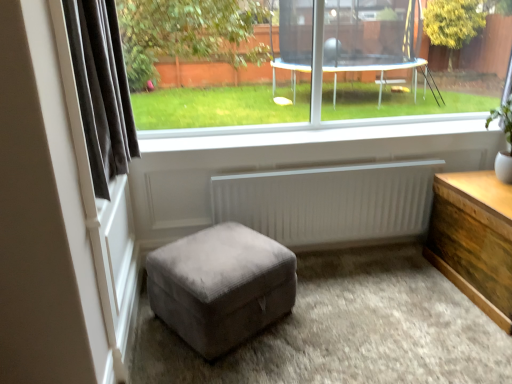
Describe the element at coordinates (221, 286) in the screenshot. I see `suede ottoman at center` at that location.

Describe the element at coordinates (330, 203) in the screenshot. The width and height of the screenshot is (512, 384). I see `white ribbed radiator at center` at that location.

Find the location of a particular element. wooden chest at right is located at coordinates (474, 239).

Locate an element on the screen. dark grey fabric curtain at left is located at coordinates point(101,89).

Can you confirm if transparent glass window at center is positioned to the left of wooden chest at right?

Indeed, transparent glass window at center is positioned on the left side of wooden chest at right.

How different are the orientations of transparent glass window at center and wooden chest at right in degrees?

90 degrees.

Is wooden chest at right inside transparent glass window at center?

That's incorrect, wooden chest at right is not inside transparent glass window at center.

Considering the sizes of transparent glass window at center and wooden chest at right in the image, is transparent glass window at center taller or shorter than wooden chest at right?

Considering their sizes, transparent glass window at center has more height than wooden chest at right.

Who is shorter, white ribbed radiator at center or transparent glass window at center?

With less height is white ribbed radiator at center.

Are white ribbed radiator at center and transparent glass window at center beside each other?

They are not placed beside each other.

From a real-world perspective, is white ribbed radiator at center physically above transparent glass window at center?

Actually, white ribbed radiator at center is physically below transparent glass window at center in the real world.

Based on their sizes in the image, would you say white smooth window sill at center is bigger or smaller than suede ottoman at center?

Clearly, white smooth window sill at center is smaller in size than suede ottoman at center.

How different are the orientations of white smooth window sill at center and suede ottoman at center in degrees?

33.8 degrees.

Is white smooth window sill at center turned away from suede ottoman at center?

white smooth window sill at center is not turned away from suede ottoman at center.

Is suede ottoman at center facing away from white smooth window sill at center?

No, suede ottoman at center is not facing the opposite direction of white smooth window sill at center.

Measure the distance between suede ottoman at center and white smooth window sill at center.

93.62 centimeters.

Choose the correct answer: Is suede ottoman at center inside white smooth window sill at center or outside it?

suede ottoman at center is not inside white smooth window sill at center, it's outside.

At what (x,y) coordinates should I click in order to perform the action: click on window sill above the suede ottoman at center (from the image's perspective). Please return your answer as a coordinate pair (x, y). Looking at the image, I should click on (309, 132).

Consider the image. Between suede ottoman at center and transparent glass window at center, which one has smaller width?

transparent glass window at center is thinner.

Is suede ottoman at center looking in the opposite direction of transparent glass window at center?

suede ottoman at center is not turned away from transparent glass window at center.

Is suede ottoman at center bigger or smaller than transparent glass window at center?

Considering their sizes, suede ottoman at center takes up less space than transparent glass window at center.

Is white ribbed radiator at center oriented away from dark grey fabric curtain at left?

No, white ribbed radiator at center's orientation is not away from dark grey fabric curtain at left.

In the scene shown: Can you confirm if white ribbed radiator at center is shorter than dark grey fabric curtain at left?

Indeed, white ribbed radiator at center has a lesser height compared to dark grey fabric curtain at left.

The width and height of the screenshot is (512, 384). In order to click on curtain on the left of white ribbed radiator at center in this screenshot , I will do `click(101, 89)`.

Which is in front, white ribbed radiator at center or dark grey fabric curtain at left?

dark grey fabric curtain at left is more forward.

Does transparent glass window at center contain white ribbed radiator at center?

That's incorrect, white ribbed radiator at center is not inside transparent glass window at center.

From the image's perspective, is transparent glass window at center located above or below white ribbed radiator at center?

Based on their image positions, transparent glass window at center is located above white ribbed radiator at center.

Which is more to the right, transparent glass window at center or white ribbed radiator at center?

white ribbed radiator at center is more to the right.

Which of these two, transparent glass window at center or white ribbed radiator at center, stands shorter?

With less height is white ribbed radiator at center.

Find the location of a particular element. window on the left of wooden chest at right is located at coordinates (404, 63).

You are a GUI agent. You are given a task and a screenshot of the screen. Output one action in this format:
    pyautogui.click(x=<x>, y=<y>)
    Task: Click on the radiator located behind the transparent glass window at center
    
    Given the screenshot: What is the action you would take?
    pyautogui.click(x=330, y=203)

Considering their positions, is wooden chest at right positioned closer to dark grey fabric curtain at left than white ribbed radiator at center?

white ribbed radiator at center is positioned closer to the anchor dark grey fabric curtain at left.

From the image, which object appears to be farther from white ribbed radiator at center, suede ottoman at center or dark grey fabric curtain at left?

dark grey fabric curtain at left lies further to white ribbed radiator at center than the other object.

When comparing their distances from white ribbed radiator at center, does suede ottoman at center or white smooth window sill at center seem further?

suede ottoman at center lies further to white ribbed radiator at center than the other object.

Based on their spatial positions, is white smooth window sill at center or suede ottoman at center closer to transparent glass window at center?

white smooth window sill at center lies closer to transparent glass window at center than the other object.

When comparing their distances from white ribbed radiator at center, does wooden chest at right or transparent glass window at center seem further?

transparent glass window at center.

Based on their spatial positions, is suede ottoman at center or transparent glass window at center closer to white ribbed radiator at center?

suede ottoman at center is closer to white ribbed radiator at center.

Which object lies further to the anchor point dark grey fabric curtain at left, white ribbed radiator at center or suede ottoman at center?

Among the two, white ribbed radiator at center is located further to dark grey fabric curtain at left.

From the image, which object appears to be farther from suede ottoman at center, wooden chest at right or white ribbed radiator at center?

wooden chest at right is positioned further to the anchor suede ottoman at center.

Image resolution: width=512 pixels, height=384 pixels. I want to click on curtain between transparent glass window at center and suede ottoman at center vertically, so click(101, 89).

The image size is (512, 384). Find the location of `radiator that lies between white smooth window sill at center and suede ottoman at center from top to bottom`. radiator that lies between white smooth window sill at center and suede ottoman at center from top to bottom is located at coordinates (330, 203).

Locate an element on the screen. The image size is (512, 384). window sill situated between suede ottoman at center and wooden chest at right from left to right is located at coordinates (309, 132).

You are a GUI agent. You are given a task and a screenshot of the screen. Output one action in this format:
    pyautogui.click(x=<x>, y=<y>)
    Task: Click on the radiator located between dark grey fabric curtain at left and white smooth window sill at center in the left-right direction
    
    Given the screenshot: What is the action you would take?
    pyautogui.click(x=330, y=203)